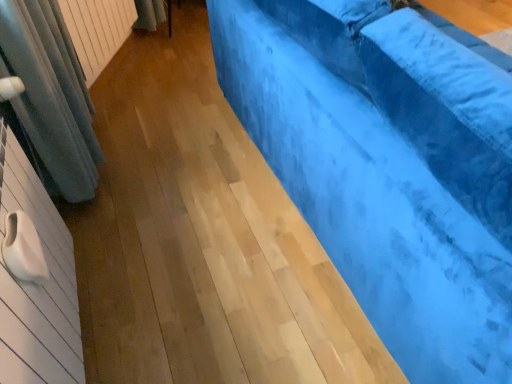
Where is `free point below white textured radiator at upper left (from a real-world perspective)`? free point below white textured radiator at upper left (from a real-world perspective) is located at coordinates (117, 76).